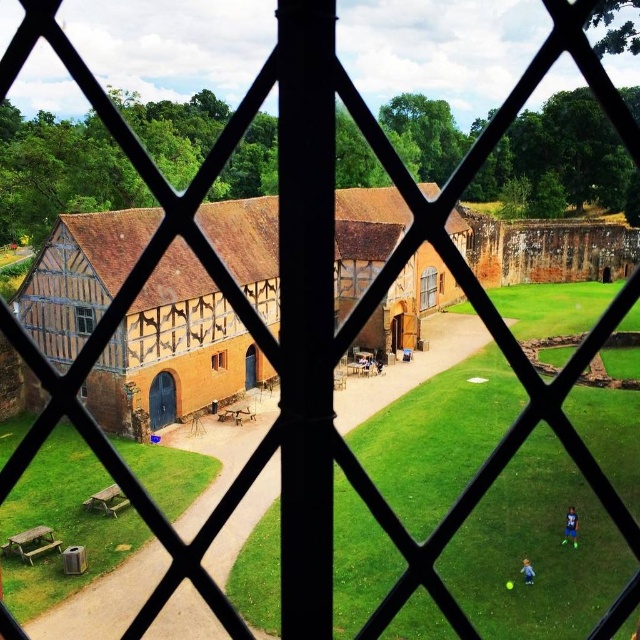
Question: Observing the image, what is the correct spatial positioning of matte brown wooden window at center in reference to wooden lattice window at center?

Choices:
 (A) right
 (B) left

Answer: (A)

Question: Is matte brown wooden window at center thinner than brown wooden window at center?

Choices:
 (A) yes
 (B) no

Answer: (B)

Question: Which point is closer to the camera?

Choices:
 (A) wooden lattice window at center
 (B) matte brown wooden window at center
 (C) brown wooden window at center

Answer: (A)

Question: Which of these objects is positioned closest to the matte brown wooden window at center?

Choices:
 (A) wooden lattice window at center
 (B) brown wooden window at center

Answer: (B)

Question: Is matte brown wooden window at center to the right of brown wooden window at center from the viewer's perspective?

Choices:
 (A) no
 (B) yes

Answer: (B)

Question: Which of these objects is positioned closest to the brown wooden window at center?

Choices:
 (A) matte brown wooden window at center
 (B) wooden lattice window at center

Answer: (B)